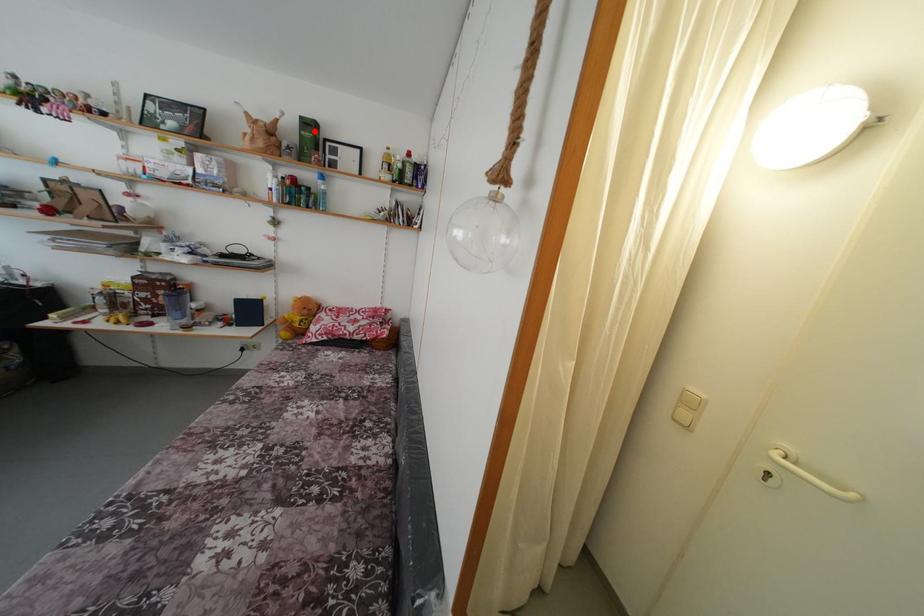
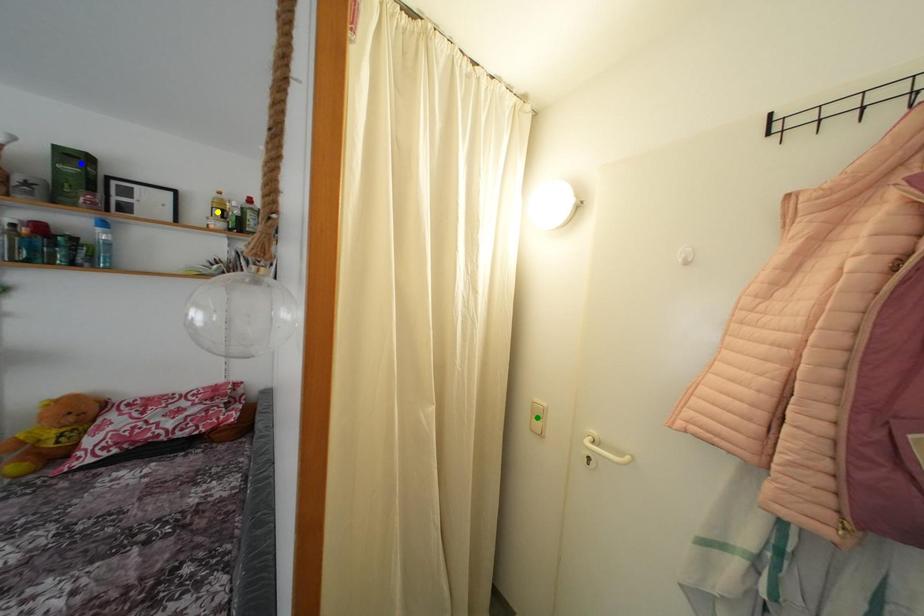
Question: I am providing you with two images of the same scene from different viewpoints. A red point is marked on the first image. You are given multiple points on the second image. In image 2, which mark is for the same physical point as the one in image 1?

Choices:
 (A) yellow point
 (B) green point
 (C) blue point

Answer: (C)